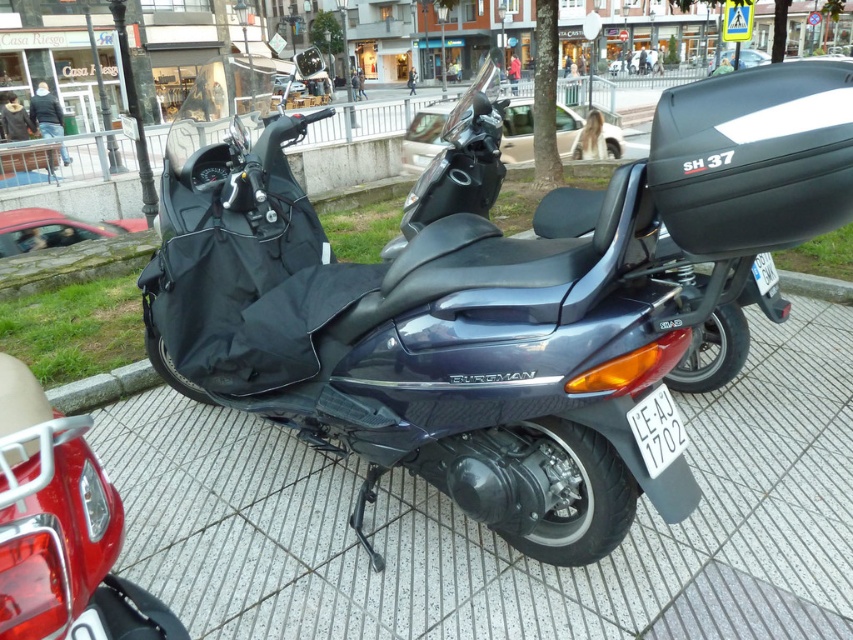
Looking at this image, you are standing on the gray textured pavement at center and want to see the black plastic license plate at lower center. Can you see it without moving your feet?

The black plastic license plate at lower center is behind the gray textured pavement at center, so you cannot see it while standing on the gray textured pavement at center without moving your feet.

You are a delivery person who needs to place a package on the ground near the Honda SH 37 scooter. The package must be placed exactly halfway between the matte black bag at lower left and the white plastic license plate at lower center. Where should you place the package?

The package should be placed exactly halfway between the matte black bag at lower left and the white plastic license plate at lower center, which are 2.55 meters apart. This means the package should be placed 1.275 meters from both objects.

You are a delivery person who needs to secure a package on the scooter. You have a matte black bag at lower left and a black plastic license plate at lower center. Where should you place the package to ensure it is above the license plate?

The package should be placed above the black plastic license plate at lower center since the matte black bag at lower left is located below it.